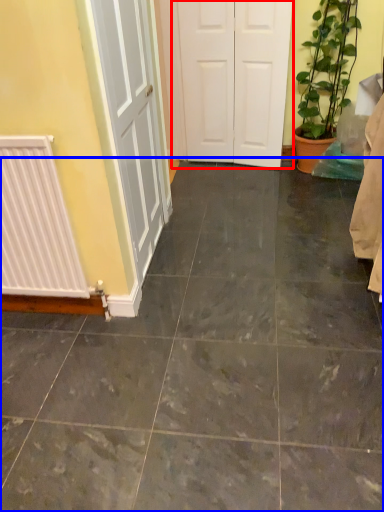
Question: Which object appears closest to the camera in this image, door (highlighted by a red box) or ceramic tile (highlighted by a blue box)?

Choices:
 (A) door
 (B) ceramic tile

Answer: (B)